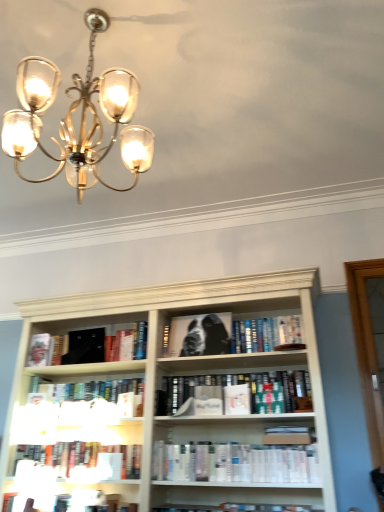
Question: Is black matte book at center, the 8th book in the bottom-to-top sequence, spatially inside hardcover book at center, which is the 1th paperback book from front to back, or outside of it?

Choices:
 (A) inside
 (B) outside

Answer: (B)

Question: From the image's perspective, relative to hardcover book at center, which is counted as the 4th paperback book, starting from the left, is black matte book at center, which is the first book from top to bottom, above or below?

Choices:
 (A) below
 (B) above

Answer: (B)

Question: Which is farther from the black glossy book at center?

Choices:
 (A) hardcover book at center, positioned as the 1th paperback book in right-to-left order
 (B) white matte book at lower center, the 2th book in the bottom-to-top sequence
 (C) hardcover books at lower center, the third book in the bottom-to-top sequence
 (D) black matte book at center, which is the first book from top to bottom
 (E) hardcover book at lower center, placed as the first book when sorted from bottom to top

Answer: (E)

Question: Which object is the farthest from the hardcover book at lower center, placed as the first book when sorted from bottom to top?

Choices:
 (A) hardcover book at center, positioned as the 3th book in top-to-bottom order
 (B) hardcover book at center, which is counted as the 4th paperback book, starting from the left
 (C) black glossy book at center
 (D) black matte book at center, which is the first book from top to bottom
 (E) white matte book at lower center, the 2th book in the bottom-to-top sequence

Answer: (D)